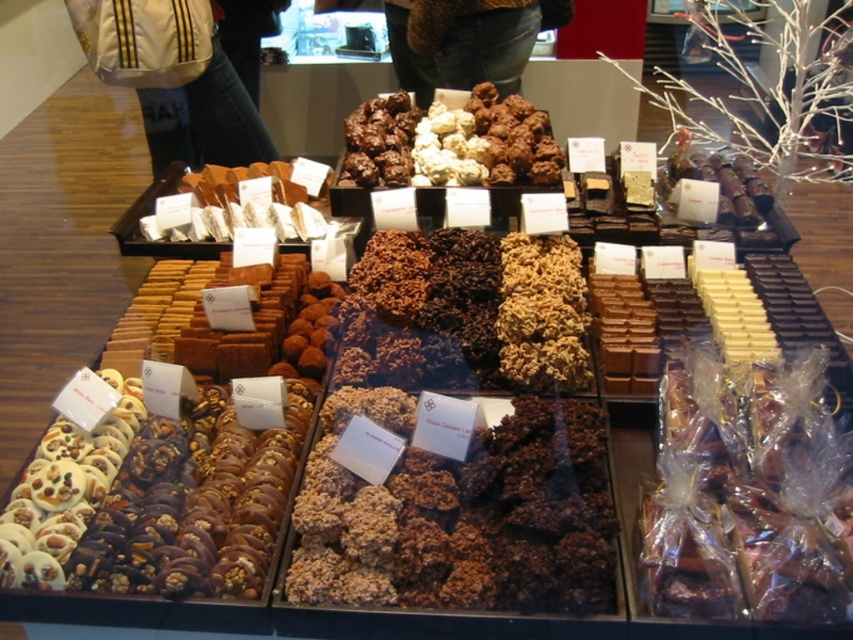
You are a customer at a chocolate shop and want to grab both the translucent plastic wrapped chocolates at lower right and the white fabric bag at upper left. Which item should you reach for first to get the one that is closer to you?

The translucent plastic wrapped chocolates at lower right is closer to the viewer than the white fabric bag at upper left, so you should reach for the translucent plastic wrapped chocolates at lower right first.

You are a customer at a chocolate shop and see the white chocolate bar at center and the brown wool sweater at upper center. Which item is closer to you?

The white chocolate bar at center is closer because it is in front of the brown wool sweater at upper center.

You are standing 1.5 meters away from the camera. Can you see the white chocolate bar at center clearly?

Yes, the white chocolate bar at center is 2.09 meters away from the camera. Since you are only 1.5 meters away from the camera, you are closer to the camera than the chocolate bar. Therefore, the distance between you and the white chocolate bar at center would be 2.09 meters minus 1.5 meters, which is 0.59 meters. This distance is within a typical comfortable viewing range, so you should be able to see it clearly.